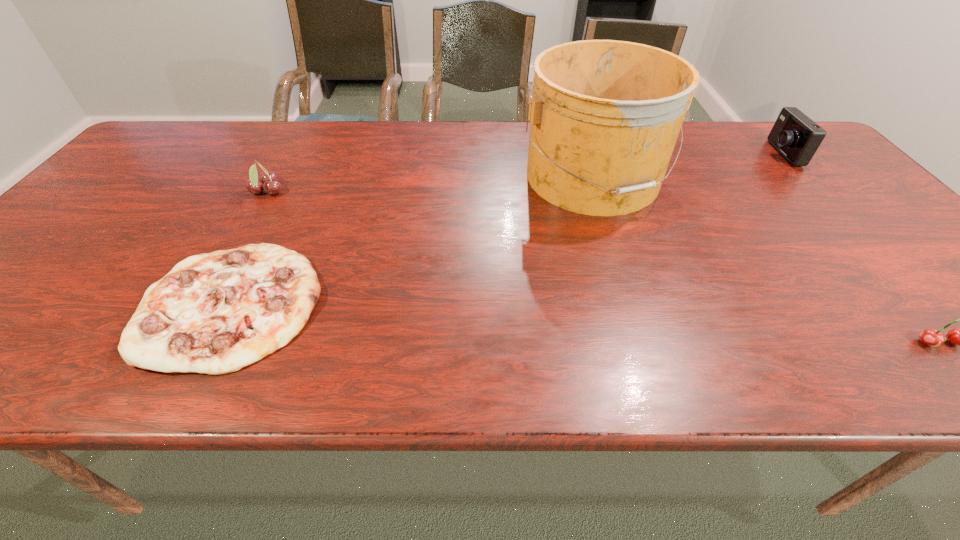
Identify the location of free space located on the left of the pizza. (84, 303).

Where is `bucket at the far edge`? The image size is (960, 540). bucket at the far edge is located at coordinates (605, 115).

Find the location of a particular element. This screenshot has width=960, height=540. camera present at the far edge is located at coordinates (797, 137).

Find the location of a particular element. The width and height of the screenshot is (960, 540). object at the near edge is located at coordinates (214, 313).

Find the location of `object positioned at the right edge`. object positioned at the right edge is located at coordinates (797, 137).

This screenshot has width=960, height=540. Find the location of `object present at the far right corner`. object present at the far right corner is located at coordinates (797, 137).

Identify the location of free space at the far edge of the desktop. The width and height of the screenshot is (960, 540). (754, 152).

Locate an element on the screen. Image resolution: width=960 pixels, height=540 pixels. vacant space at the near edge of the desktop is located at coordinates (287, 378).

Find the location of a particular element. This screenshot has height=540, width=960. free space at the left edge of the desktop is located at coordinates (122, 170).

The width and height of the screenshot is (960, 540). Identify the location of vacant space at the far left corner. (199, 135).